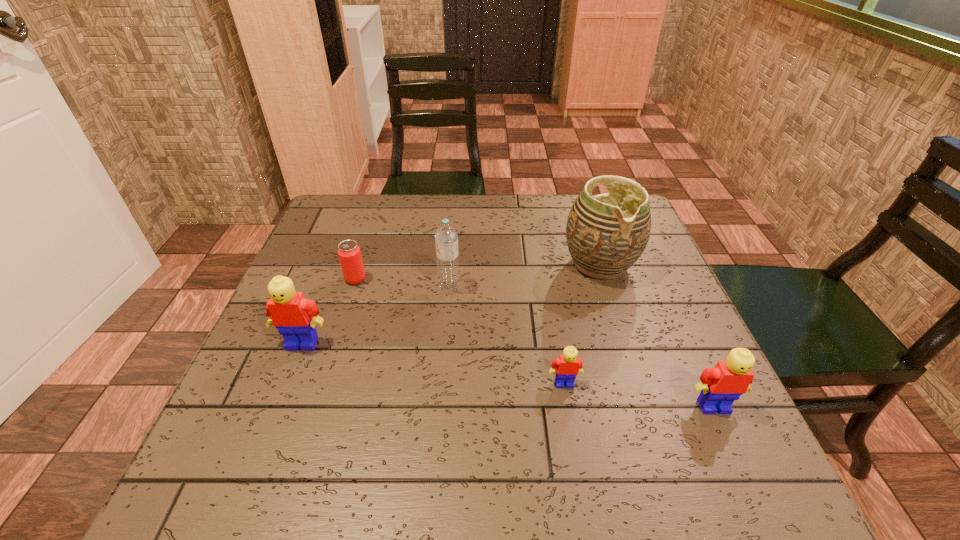
Please mark a free spot for a new Lego to balance the arrangement. Please provide its 2D coordinates. Your answer should be formatted as a tuple, i.e. [(x, y)], where the tuple contains the x and y coordinates of a point satisfying the conditions above.

[(428, 362)]